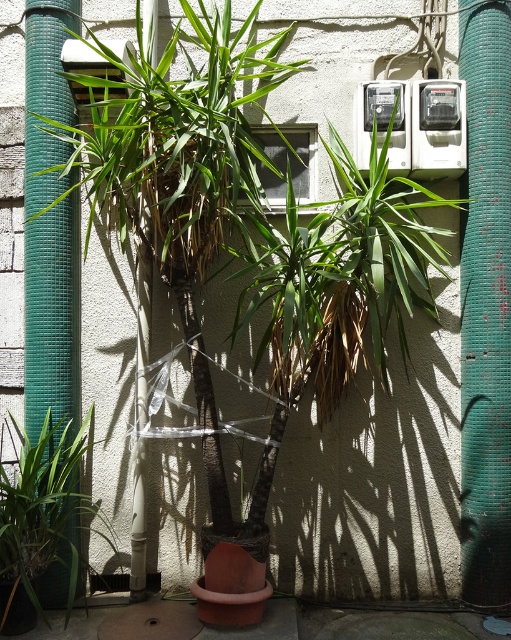
Question: Is green mesh pipe at left above green matte plant at lower left?

Choices:
 (A) no
 (B) yes

Answer: (B)

Question: Which point is farther from the camera taking this photo?

Choices:
 (A) (42, 160)
 (B) (88, 426)

Answer: (B)

Question: Considering the relative positions of green mesh pipe at left and green matte plant at lower left in the image provided, where is green mesh pipe at left located with respect to green matte plant at lower left?

Choices:
 (A) right
 (B) left

Answer: (B)

Question: Is green mesh pipe at left above green matte plant at lower left?

Choices:
 (A) no
 (B) yes

Answer: (B)

Question: Which of the following is the farthest from the observer?

Choices:
 (A) green mesh pipe at left
 (B) green matte plant at lower left

Answer: (A)